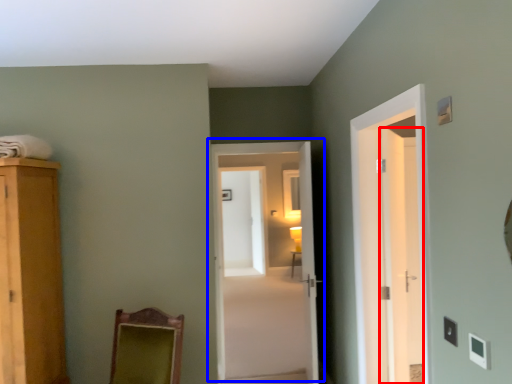
Question: Among these objects, which one is nearest to the camera, door (highlighted by a red box) or door (highlighted by a blue box)?

Choices:
 (A) door
 (B) door

Answer: (B)